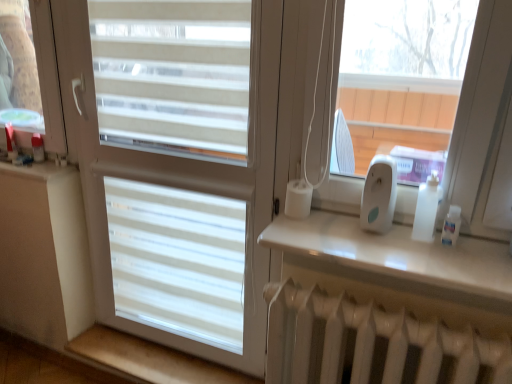
Question: From a real-world perspective, is beige wood at lower left, the second window sill from the top, on white plastic ipod at right?

Choices:
 (A) no
 (B) yes

Answer: (A)

Question: Is beige wood at lower left, arranged as the 1th window sill when viewed from the back, far away from white plastic ipod at right?

Choices:
 (A) yes
 (B) no

Answer: (A)

Question: Is white plastic ipod at right located within beige wood at lower left, arranged as the 1th window sill when viewed from the back?

Choices:
 (A) no
 (B) yes

Answer: (A)

Question: Is beige wood at lower left, the first window sill ordered from the bottom, positioned behind white plastic ipod at right?

Choices:
 (A) yes
 (B) no

Answer: (A)

Question: From a real-world perspective, is beige wood at lower left, the second window sill from the top, below white plastic ipod at right?

Choices:
 (A) no
 (B) yes

Answer: (B)

Question: Can you confirm if beige wood at lower left, the second window sill from the top, is positioned to the left of white plastic ipod at right?

Choices:
 (A) yes
 (B) no

Answer: (A)

Question: Would you say white plastic ipod at right is part of white glossy shelf at upper right, the second window sill from the back,'s contents?

Choices:
 (A) no
 (B) yes

Answer: (A)

Question: Can you confirm if white glossy shelf at upper right, arranged as the 1th window sill when viewed from the right, is positioned to the left of white plastic ipod at right?

Choices:
 (A) yes
 (B) no

Answer: (A)

Question: Is white glossy shelf at upper right, the second window sill from the back, smaller than white plastic ipod at right?

Choices:
 (A) yes
 (B) no

Answer: (B)

Question: Is white glossy shelf at upper right, which ranks as the 1th window sill in front-to-back order, taller than white plastic ipod at right?

Choices:
 (A) no
 (B) yes

Answer: (A)

Question: Is white glossy shelf at upper right, which ranks as the 1th window sill in front-to-back order, far away from white plastic ipod at right?

Choices:
 (A) yes
 (B) no

Answer: (B)

Question: Is white glossy shelf at upper right, which ranks as the 1th window sill in top-to-bottom order, closer to camera compared to white plastic ipod at right?

Choices:
 (A) yes
 (B) no

Answer: (A)

Question: Is white matte window at center further to camera compared to beige wood at lower left, the 1th window sill when ordered from left to right?

Choices:
 (A) yes
 (B) no

Answer: (B)